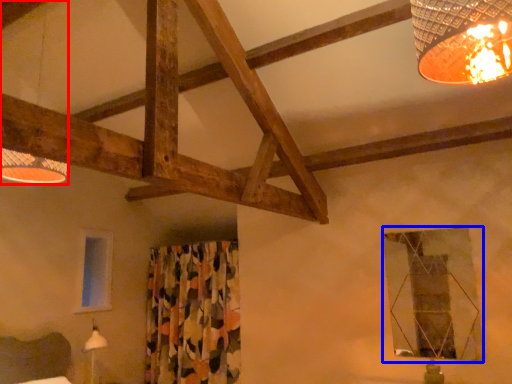
Question: Which object is closer to the camera taking this photo, lamp (highlighted by a red box) or window (highlighted by a blue box)?

Choices:
 (A) lamp
 (B) window

Answer: (A)